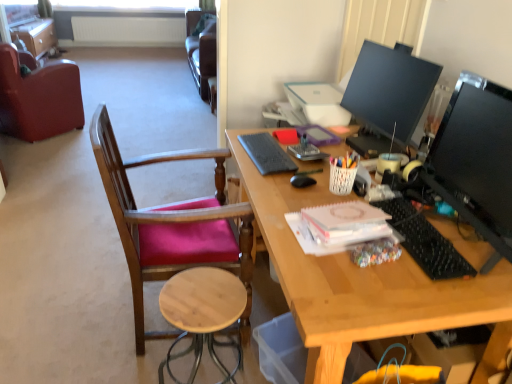
Identify the location of empty space that is ontop of natural wood stool at lower center (from a real-world perspective). (199, 297).